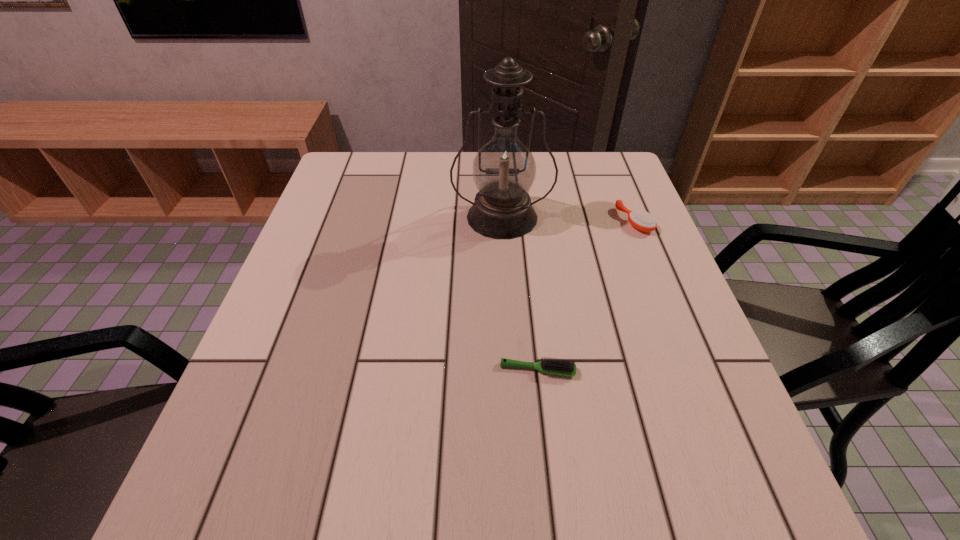
Image resolution: width=960 pixels, height=540 pixels. What are the coordinates of `free space at the far edge` in the screenshot? It's located at (449, 174).

Find the location of `vacant space at the left edge of the desktop`. vacant space at the left edge of the desktop is located at coordinates (272, 431).

In the image, there is a desktop. Where is `free space at the right edge`? Image resolution: width=960 pixels, height=540 pixels. free space at the right edge is located at coordinates (641, 251).

The image size is (960, 540). In order to click on vacant position at the far left corner of the desktop in this screenshot , I will do `click(391, 163)`.

In the image, there is a desktop. At what (x,y) coordinates should I click in order to perform the action: click on free space at the near left corner. Please return your answer as a coordinate pair (x, y). The image size is (960, 540). Looking at the image, I should click on (300, 470).

The height and width of the screenshot is (540, 960). In order to click on free region at the far right corner of the desktop in this screenshot , I will do `click(605, 168)`.

In the image, there is a desktop. Find the location of `vacant space at the near right corner`. vacant space at the near right corner is located at coordinates (706, 519).

Find the location of a particular element. The image size is (960, 540). free space that is in between the shorter hairbrush and the tallest object is located at coordinates (520, 293).

This screenshot has width=960, height=540. I want to click on free spot between the rightmost object and the shorter hairbrush, so click(586, 295).

Identify the location of free point between the taller hairbrush and the tallest object. The image size is (960, 540). (568, 219).